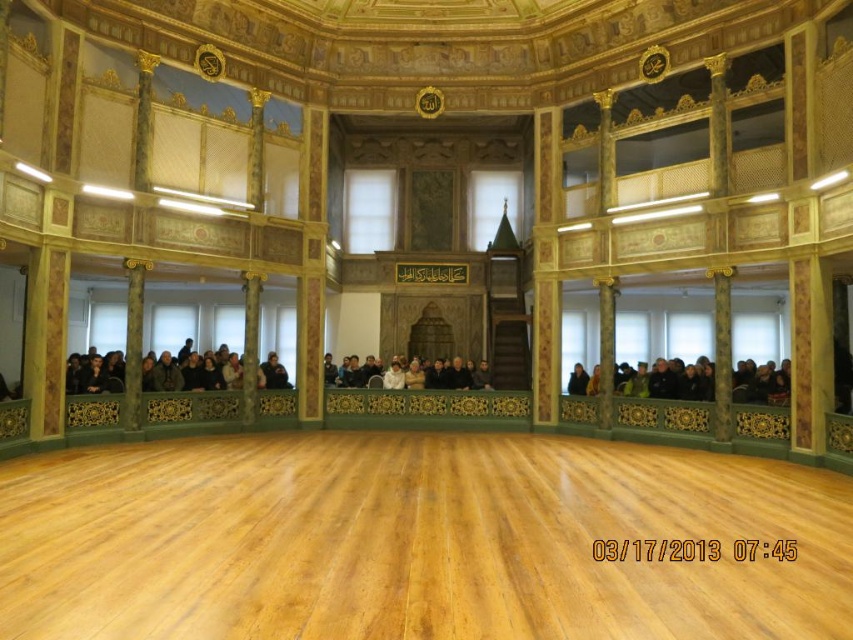
You are standing in the grand hall and want to move towards the exit located at the far right corner. You see the dark brown wood crowd at lower left and the dark gray fabric crowd at center. Which crowd should you avoid to reach the exit more quickly?

You should avoid the dark brown wood crowd at lower left because it is positioned on the left side of the dark gray fabric crowd at center, so moving around the right side of the dark gray fabric crowd at center would provide a clearer path towards the exit at the far right corner.

You are an architect designing a new mosque and want to ensure accessibility for all visitors. You notice the dark brown wood crowd at lower left and the dark gray fabric crowd at center in the reference image. Which crowd is positioned higher up in the hall?

The dark brown wood crowd at lower left is located above the dark gray fabric crowd at center, so it is positioned higher up in the hall.

You are standing in the grand hall and want to place a new decorative item at the exact location of the point marked as point [670,381]. What object currently occupies that location?

The point [670,381] marks the location of the dark brown leather jacket at lower right, so placing the new decorative item there would require moving the existing jacket.